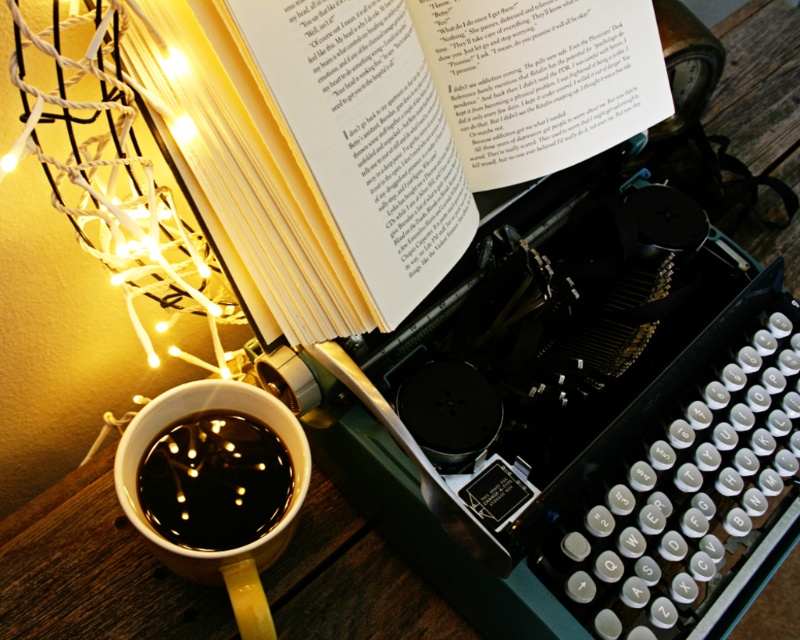
Between white paper book at upper center and matte ceramic mug at lower left, which one is positioned higher?

Positioned higher is white paper book at upper center.

Between white paper book at upper center and matte ceramic mug at lower left, which one appears on the left side from the viewer's perspective?

From the viewer's perspective, matte ceramic mug at lower left appears more on the left side.

The width and height of the screenshot is (800, 640). In order to click on white paper book at upper center in this screenshot , I will do `click(384, 129)`.

You are a GUI agent. You are given a task and a screenshot of the screen. Output one action in this format:
    pyautogui.click(x=<x>, y=<y>)
    Task: Click on the white paper book at upper center
    
    Given the screenshot: What is the action you would take?
    pyautogui.click(x=384, y=129)

Is white paper book at upper center below black glossy mug at lower left?

Actually, white paper book at upper center is above black glossy mug at lower left.

Find the location of a particular element. The width and height of the screenshot is (800, 640). white paper book at upper center is located at coordinates (384, 129).

Which is more to the left, matte ceramic mug at lower left or black glossy mug at lower left?

From the viewer's perspective, black glossy mug at lower left appears more on the left side.

Is matte ceramic mug at lower left bigger than black glossy mug at lower left?

Yes.

Who is more forward, (193, 500) or (262, 433)?

Positioned in front is point (193, 500).

Where is `matte ceramic mug at lower left`? matte ceramic mug at lower left is located at coordinates (216, 486).